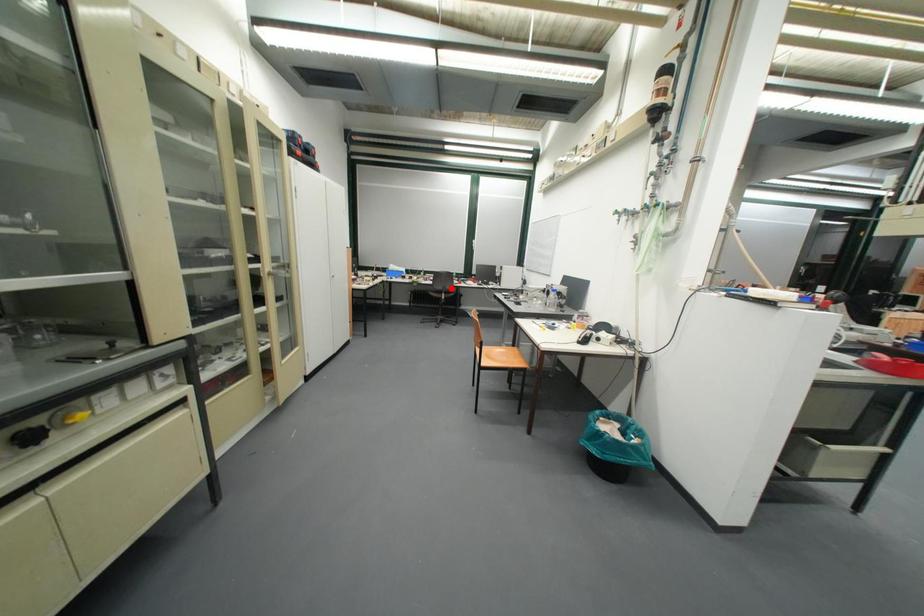
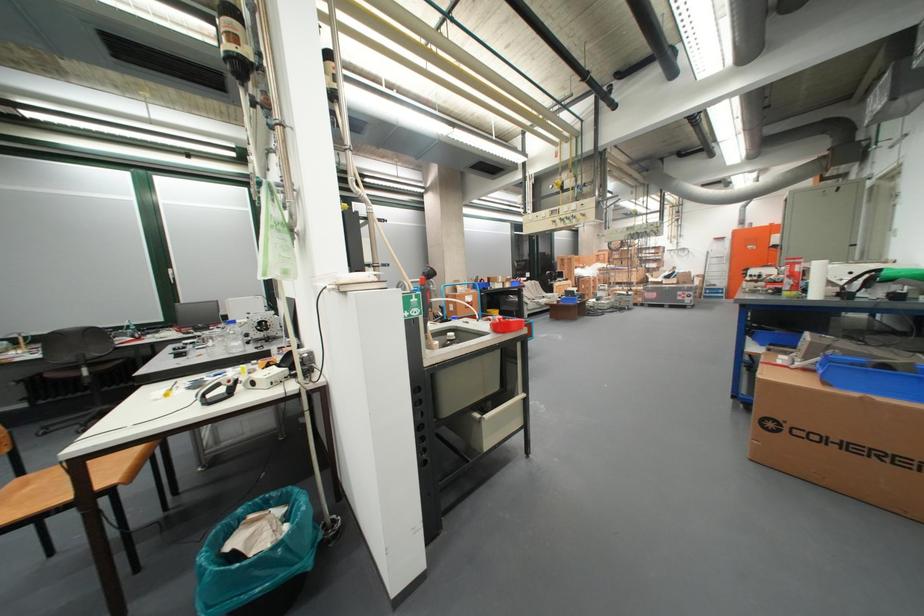
Question: A red point is marked in image1. In image2, is the corresponding 3D point closer to the camera or farther? Reply with the corresponding letter.

Choices:
 (A) The corresponding 3D point is closer.
 (B) The corresponding 3D point is farther.

Answer: (B)